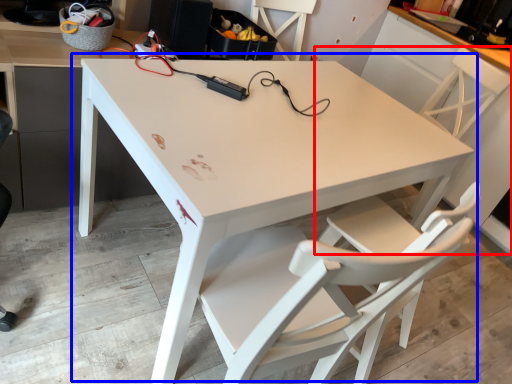
Question: Which of the following is the closest to the observer, chair (highlighted by a red box) or table (highlighted by a blue box)?

Choices:
 (A) chair
 (B) table

Answer: (B)